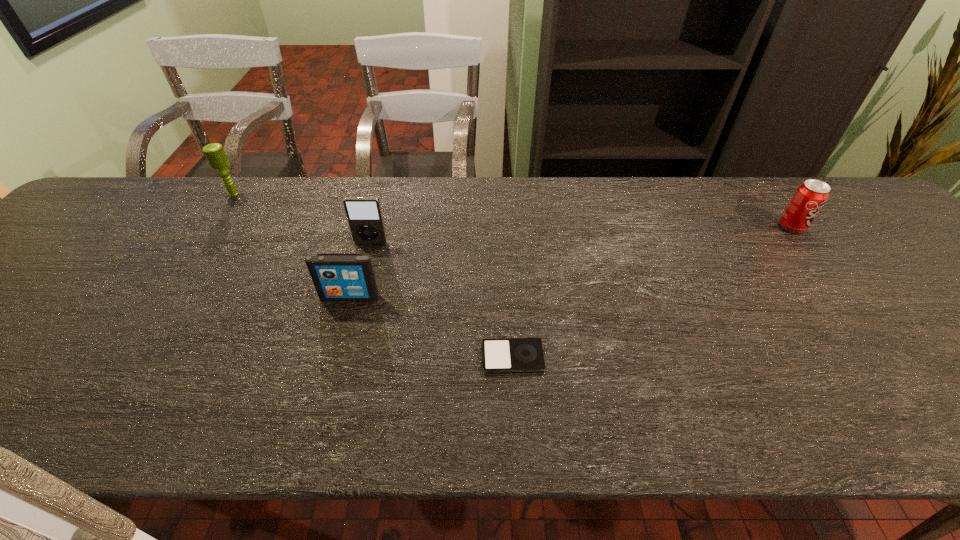
This screenshot has width=960, height=540. Identify the location of vacant space located on the front of the rightmost object. (812, 253).

Where is `vacant region located 0.240m on the front screen of the fourth farthest object`? The height and width of the screenshot is (540, 960). vacant region located 0.240m on the front screen of the fourth farthest object is located at coordinates (323, 397).

Image resolution: width=960 pixels, height=540 pixels. I want to click on vacant position located 0.350m on the left of the rightmost iPod, so click(312, 357).

In order to click on microphone located in the far edge section of the desktop in this screenshot , I will do `click(214, 152)`.

The height and width of the screenshot is (540, 960). I want to click on soda located in the far edge section of the desktop, so click(810, 197).

In the image, there is a desktop. Identify the location of blank space at the far edge. (467, 202).

At what (x,y) coordinates should I click in order to perform the action: click on vacant space at the near edge of the desktop. Please return your answer as a coordinate pair (x, y). The height and width of the screenshot is (540, 960). Looking at the image, I should click on (655, 423).

In the image, there is a desktop. Identify the location of vacant space at the left edge. (83, 255).

Identify the location of vacant space at the right edge. (942, 350).

In order to click on vacant region at the far left corner of the desktop in this screenshot , I will do `click(116, 221)`.